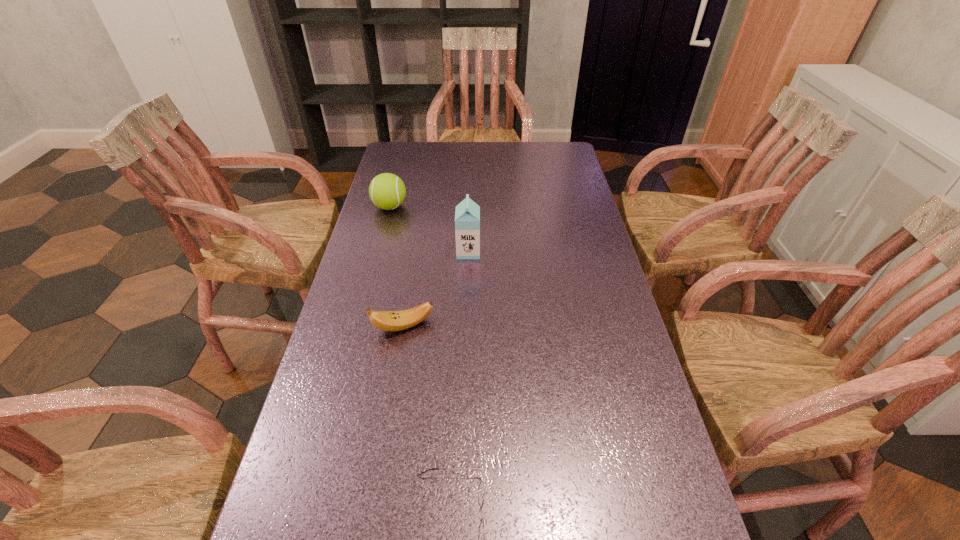
Locate an element on the screen. This screenshot has height=540, width=960. the second farthest object is located at coordinates (467, 214).

The height and width of the screenshot is (540, 960). I want to click on the tallest object, so click(467, 214).

Locate an element on the screen. the third shortest object is located at coordinates (387, 191).

You are a GUI agent. You are given a task and a screenshot of the screen. Output one action in this format:
    pyautogui.click(x=<x>, y=<y>)
    Task: Click on the tennis ball
    The image size is (960, 540).
    Given the screenshot: What is the action you would take?
    pos(387,191)

Find the location of a particular element. the second shortest object is located at coordinates (384, 320).

Where is `the second nearest object`? Image resolution: width=960 pixels, height=540 pixels. the second nearest object is located at coordinates (384, 320).

The image size is (960, 540). Identify the location of free space located on the back of the milk carton. (470, 194).

In order to click on vacant point located 0.090m on the back of the farthest object in this screenshot , I will do (396, 184).

The height and width of the screenshot is (540, 960). Identify the location of free location located 0.340m on the front of the third farthest object. tap(377, 481).

Identify the location of tennis ball that is positioned at the left edge. This screenshot has width=960, height=540. (387, 191).